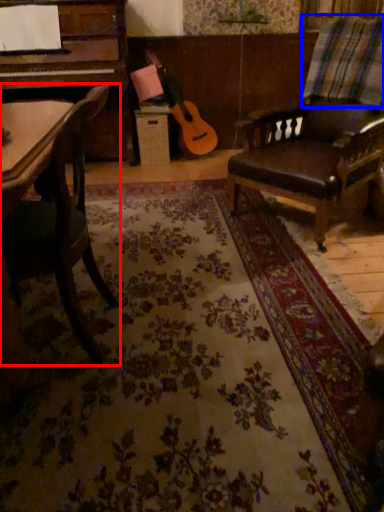
Question: Among these objects, which one is farthest to the camera, chair (highlighted by a red box) or plaid (highlighted by a blue box)?

Choices:
 (A) chair
 (B) plaid

Answer: (B)